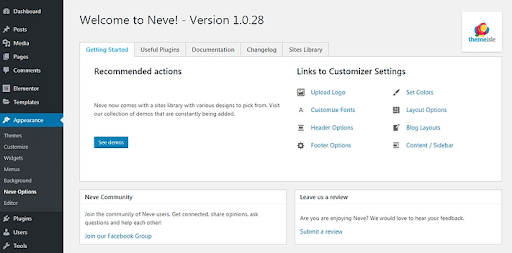
Locate an element on the screen. This screenshot has width=512, height=253. white frames is located at coordinates (196, 129), (232, 203), (426, 201).